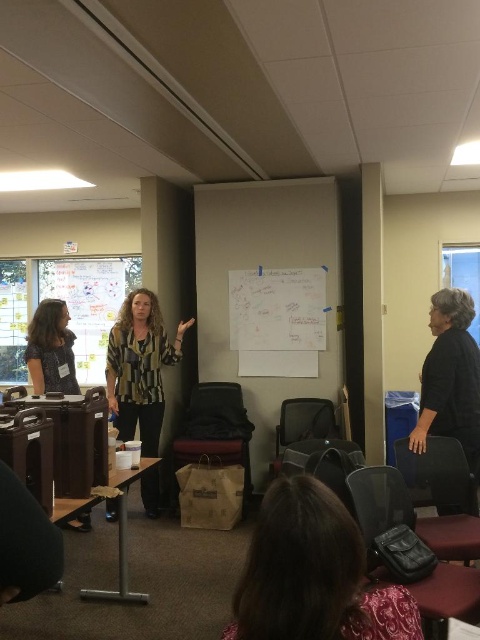
Which is behind, point (269, 611) or point (110, 513)?

The point (110, 513) is behind.

At what (x,y) coordinates should I click in order to perform the action: click on dark brown leather bag at lower center. Please return your answer as a coordinate pair (x, y). Looking at the image, I should click on (312, 573).

Is point (128, 312) positioned after point (43, 333)?

That is True.

What do you see at coordinates (140, 368) in the screenshot? I see `striped fabric blouse at center` at bounding box center [140, 368].

Identify the location of striped fabric blouse at center. This screenshot has width=480, height=640. (140, 368).

From the picture: Does dark brown leather bag at lower center have a lesser width compared to matte black shirt at left?

No, dark brown leather bag at lower center is not thinner than matte black shirt at left.

Between point (325, 588) and point (39, 344), which one is positioned behind?

Point (39, 344)

Is point (322, 572) farther from viewer compared to point (33, 356)?

No, it is not.

I want to click on dark brown leather bag at lower center, so click(x=312, y=573).